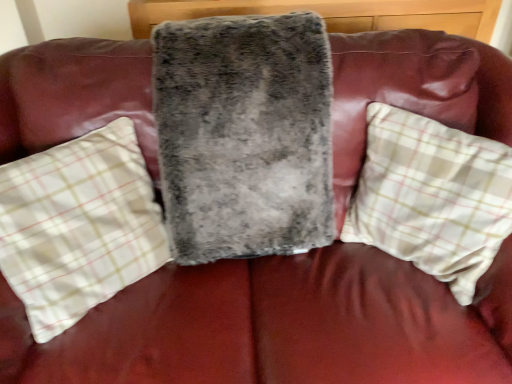
Question: Is fuzzy gray pillow at center, the 1th pillow from the left, at the right side of fuzzy gray blanket at center?

Choices:
 (A) yes
 (B) no

Answer: (B)

Question: Considering the relative sizes of fuzzy gray pillow at center, the 1th pillow from the left, and fuzzy gray blanket at center in the image provided, is fuzzy gray pillow at center, the 1th pillow from the left, smaller than fuzzy gray blanket at center?

Choices:
 (A) no
 (B) yes

Answer: (B)

Question: Does fuzzy gray pillow at center, which ranks as the second pillow in right-to-left order, have a greater height compared to fuzzy gray blanket at center?

Choices:
 (A) yes
 (B) no

Answer: (B)

Question: Are fuzzy gray pillow at center, the 1th pillow from the left, and fuzzy gray blanket at center making contact?

Choices:
 (A) yes
 (B) no

Answer: (B)

Question: From the image's perspective, is fuzzy gray pillow at center, the 1th pillow from the left, on top of fuzzy gray blanket at center?

Choices:
 (A) yes
 (B) no

Answer: (B)

Question: Considering the positions of white plaid pillow at right, which ranks as the first pillow in right-to-left order, and fuzzy gray pillow at center, which ranks as the second pillow in right-to-left order, in the image, is white plaid pillow at right, which ranks as the first pillow in right-to-left order, wider or thinner than fuzzy gray pillow at center, which ranks as the second pillow in right-to-left order,?

Choices:
 (A) wide
 (B) thin

Answer: (B)

Question: Do you think white plaid pillow at right, which ranks as the first pillow in right-to-left order, is within fuzzy gray pillow at center, which ranks as the second pillow in right-to-left order, or outside of it?

Choices:
 (A) outside
 (B) inside

Answer: (A)

Question: From a real-world perspective, is white plaid pillow at right, which is the 2th pillow in left-to-right order, physically located above or below fuzzy gray pillow at center, the 1th pillow from the left?

Choices:
 (A) above
 (B) below

Answer: (A)

Question: Is white plaid pillow at right, which ranks as the first pillow in right-to-left order, to the left or to the right of fuzzy gray pillow at center, the 1th pillow from the left, in the image?

Choices:
 (A) left
 (B) right

Answer: (B)

Question: From a real-world perspective, is fuzzy gray blanket at center physically located above or below fuzzy gray pillow at center, which ranks as the second pillow in right-to-left order?

Choices:
 (A) below
 (B) above

Answer: (B)

Question: Considering the positions of fuzzy gray blanket at center and fuzzy gray pillow at center, which ranks as the second pillow in right-to-left order, in the image, is fuzzy gray blanket at center wider or thinner than fuzzy gray pillow at center, which ranks as the second pillow in right-to-left order,?

Choices:
 (A) thin
 (B) wide

Answer: (B)

Question: Looking at the image, does fuzzy gray blanket at center seem bigger or smaller compared to fuzzy gray pillow at center, the 1th pillow from the left?

Choices:
 (A) big
 (B) small

Answer: (A)

Question: Considering the relative positions of fuzzy gray blanket at center and fuzzy gray pillow at center, the 1th pillow from the left, in the image provided, is fuzzy gray blanket at center to the left or to the right of fuzzy gray pillow at center, the 1th pillow from the left,?

Choices:
 (A) right
 (B) left

Answer: (A)

Question: From the image's perspective, relative to fuzzy gray blanket at center, is white plaid pillow at right, which ranks as the first pillow in right-to-left order, above or below?

Choices:
 (A) above
 (B) below

Answer: (B)

Question: In the image, is white plaid pillow at right, which is the 2th pillow in left-to-right order, on the left side or the right side of fuzzy gray blanket at center?

Choices:
 (A) right
 (B) left

Answer: (A)